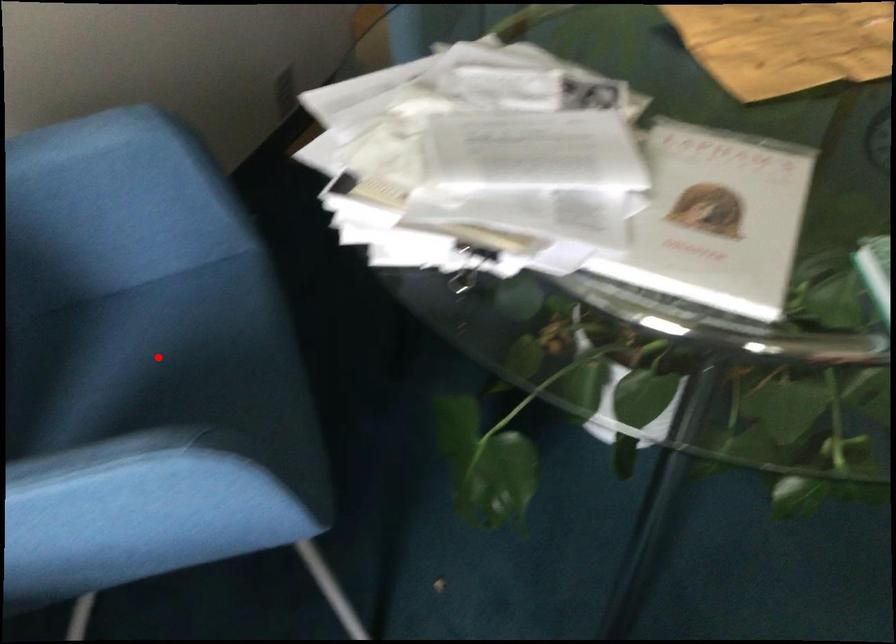
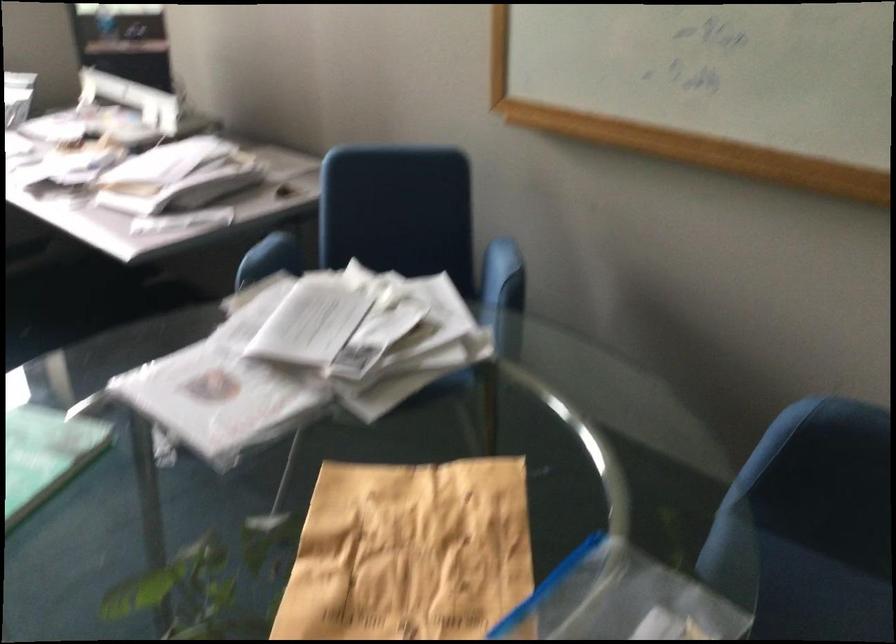
Question: I am providing you with two images of the same scene from different viewpoints. A red point is marked on the first image. Is the red point's position out of view in image 2?

Choices:
 (A) Yes
 (B) No

Answer: (A)